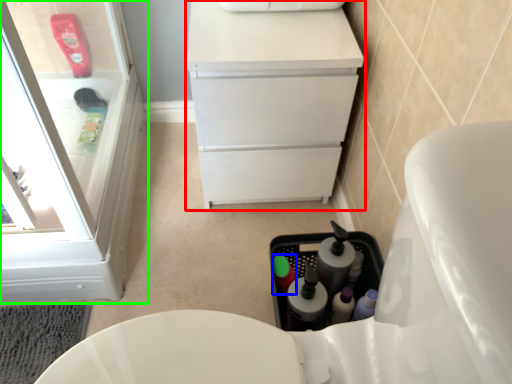
Question: Which object is positioned closest to vanity (highlighted by a red box)? Select from bottle (highlighted by a blue box) and bathroom cabinet (highlighted by a green box).

Choices:
 (A) bottle
 (B) bathroom cabinet

Answer: (A)